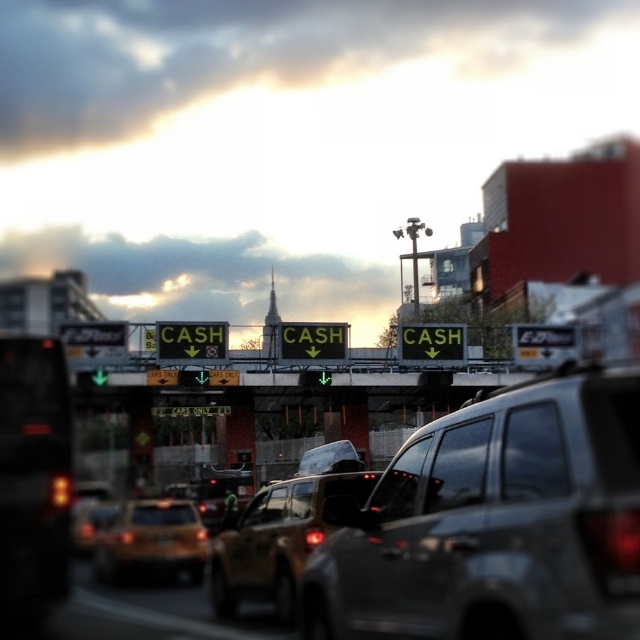
Which of these two, orange matte taxi cab at center or black plastic license plate at center, stands taller?

With more height is orange matte taxi cab at center.

Which is in front, point (131, 556) or point (163, 536)?

Point (131, 556)

Who is more distant from viewer, (193,544) or (161,538)?

Point (193,544)

The height and width of the screenshot is (640, 640). I want to click on orange matte taxi cab at center, so click(x=150, y=541).

This screenshot has width=640, height=640. Describe the element at coordinates (33, 472) in the screenshot. I see `matte black suv at left` at that location.

The width and height of the screenshot is (640, 640). I want to click on matte black suv at left, so click(x=33, y=472).

This screenshot has width=640, height=640. Find the location of `matte black suv at left`. matte black suv at left is located at coordinates (33, 472).

Can you confirm if metallic gray suv at center is positioned below orange matte taxi cab at center?

No, metallic gray suv at center is not below orange matte taxi cab at center.

Locate an element on the screen. metallic gray suv at center is located at coordinates tap(493, 522).

Who is more distant from viewer, (556, 371) or (198, 556)?

The point (198, 556) is behind.

This screenshot has height=640, width=640. Find the location of `metallic gray suv at center`. metallic gray suv at center is located at coordinates (493, 522).